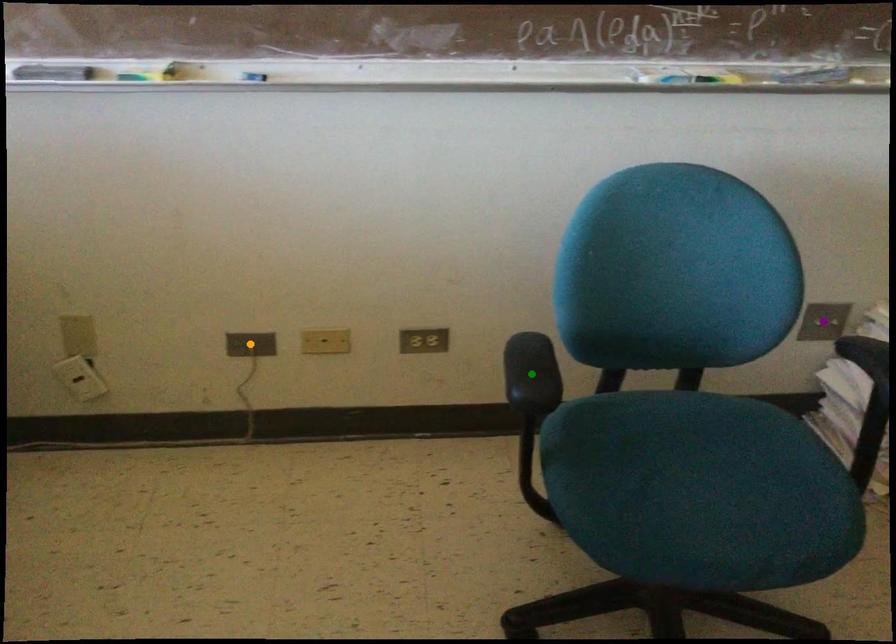
Order these from nearest to farthest:
green point | purple point | orange point

purple point
orange point
green point